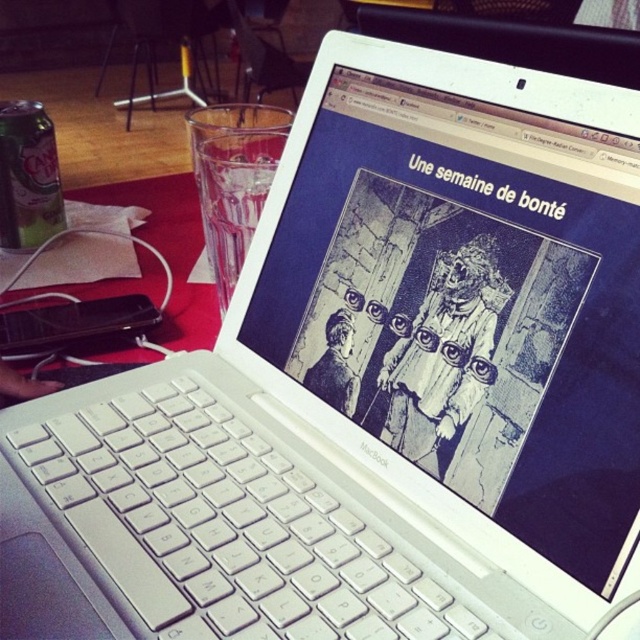
This screenshot has width=640, height=640. Describe the element at coordinates (442, 353) in the screenshot. I see `black paper doll at center` at that location.

Is point (422, 428) more distant than point (38, 209)?

No, it is not.

Identify the location of black paper doll at center. (442, 353).

Who is higher up, black paper doll at center or black paper bag at center?

black paper doll at center is above.

Does black paper doll at center have a larger size compared to black paper bag at center?

Yes, black paper doll at center is bigger than black paper bag at center.

Is point (452, 296) positioned in front of point (348, 340)?

Yes, it is.

Where is `black paper doll at center`? This screenshot has width=640, height=640. black paper doll at center is located at coordinates 442,353.

Between white plastic keyboard at center and black paper doll at center, which one is positioned lower?

white plastic keyboard at center

Identify the location of white plastic keyboard at center. tap(202, 524).

Image resolution: width=640 pixels, height=640 pixels. I want to click on white plastic keyboard at center, so click(x=202, y=524).